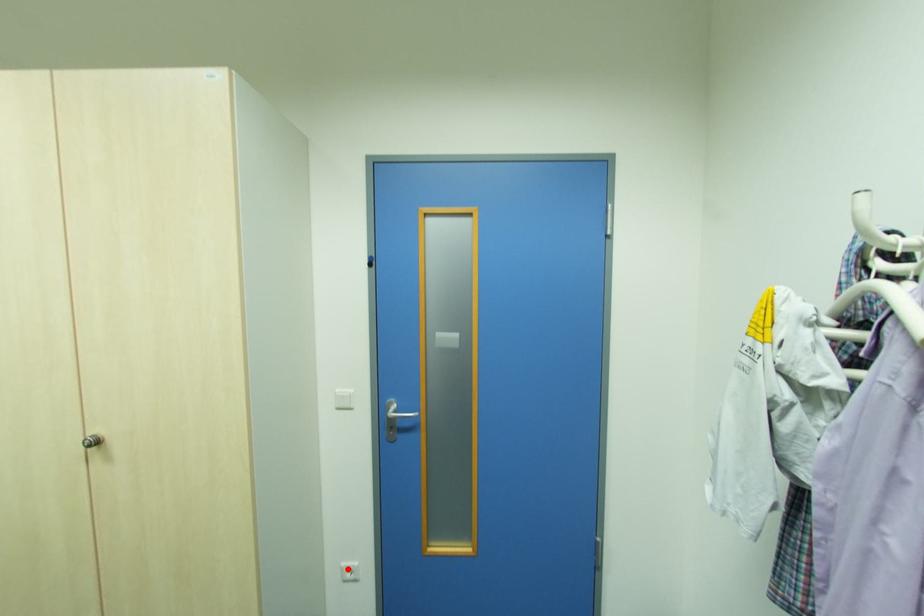
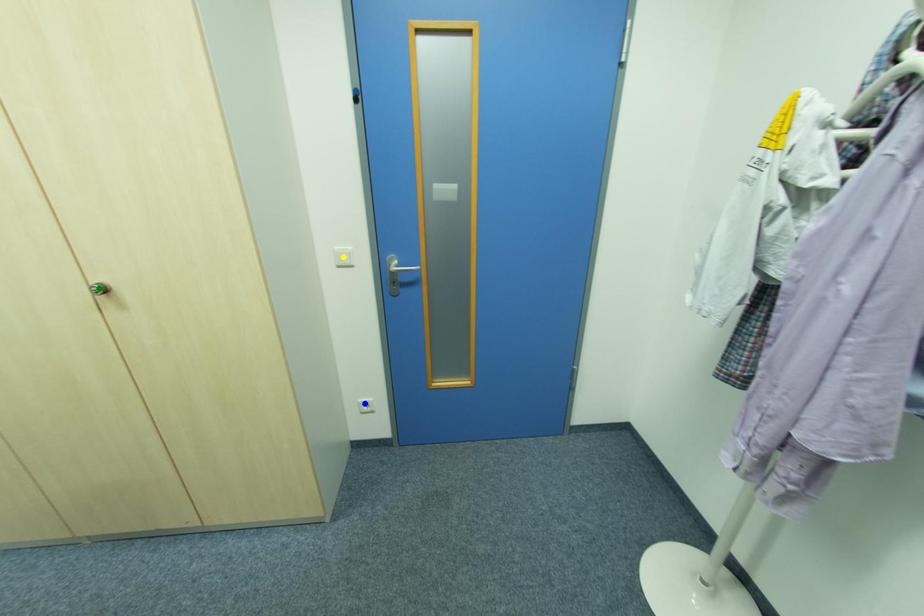
Question: I am providing you with two images of the same scene from different viewpoints. A red point is marked on the first image. You are given multiple points on the second image. Can you choose the point in image 2 that corresponds to the point in image 1?

Choices:
 (A) yellow point
 (B) green point
 (C) blue point

Answer: (C)